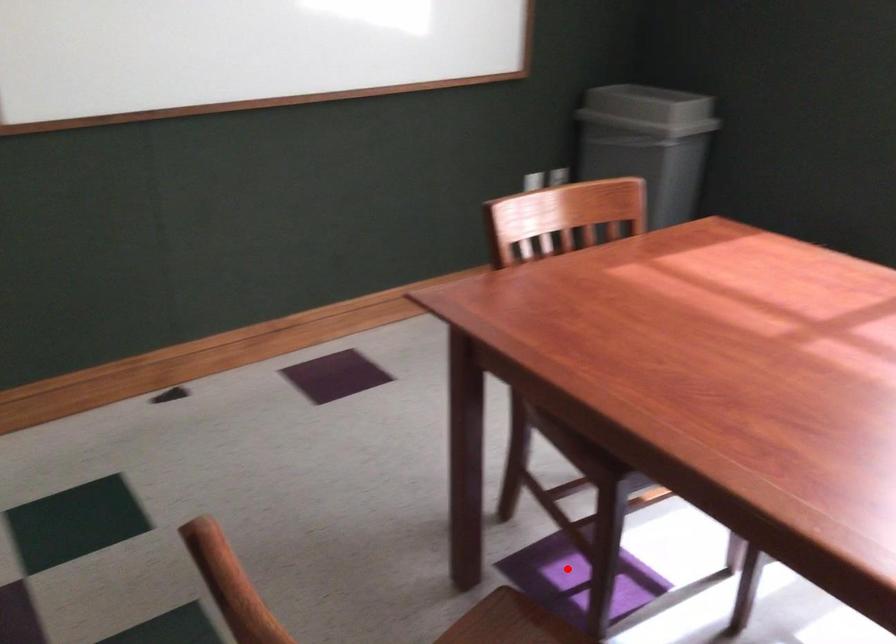
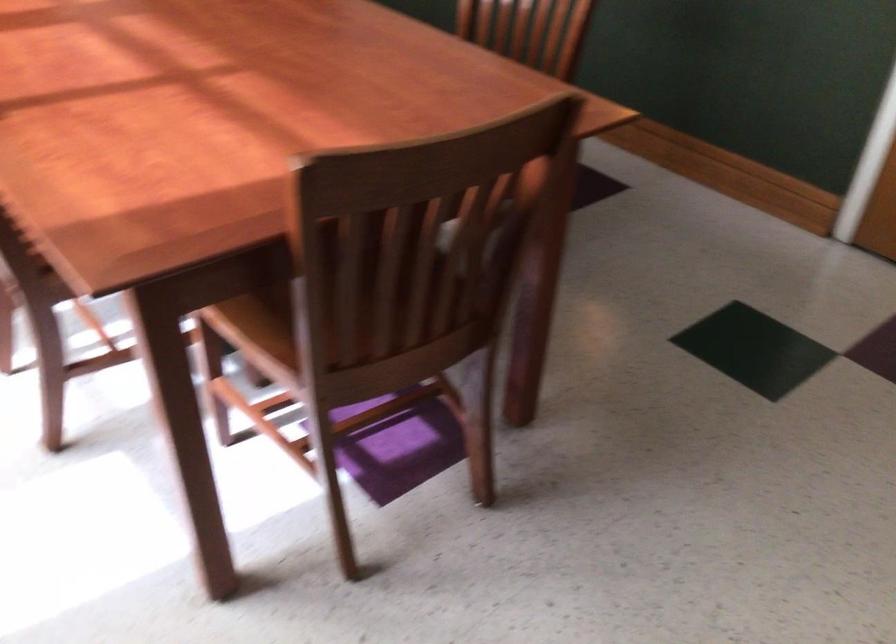
Where in the second image is the point corresponding to the highlighted location from the first image?

(398, 447)